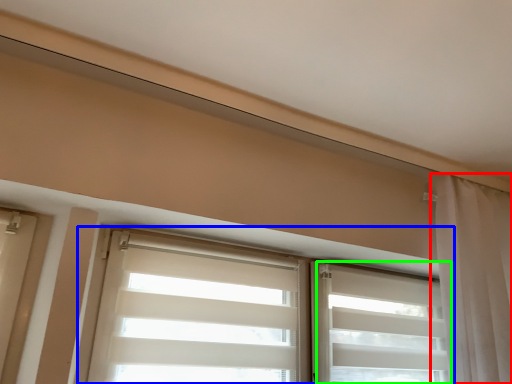
Question: Which is farther away from curtain (highlighted by a red box)? window (highlighted by a blue box) or shutter (highlighted by a green box)?

Choices:
 (A) window
 (B) shutter

Answer: (A)